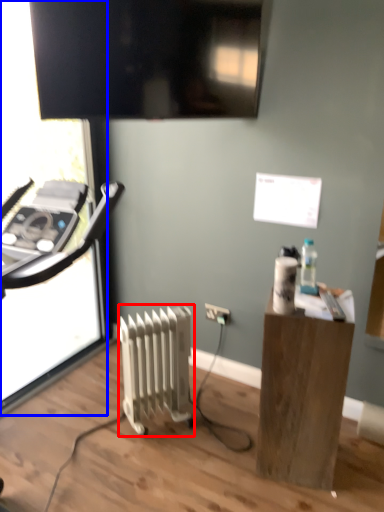
Question: Among these objects, which one is farthest to the camera, radiator (highlighted by a red box) or screen door (highlighted by a blue box)?

Choices:
 (A) radiator
 (B) screen door

Answer: (A)